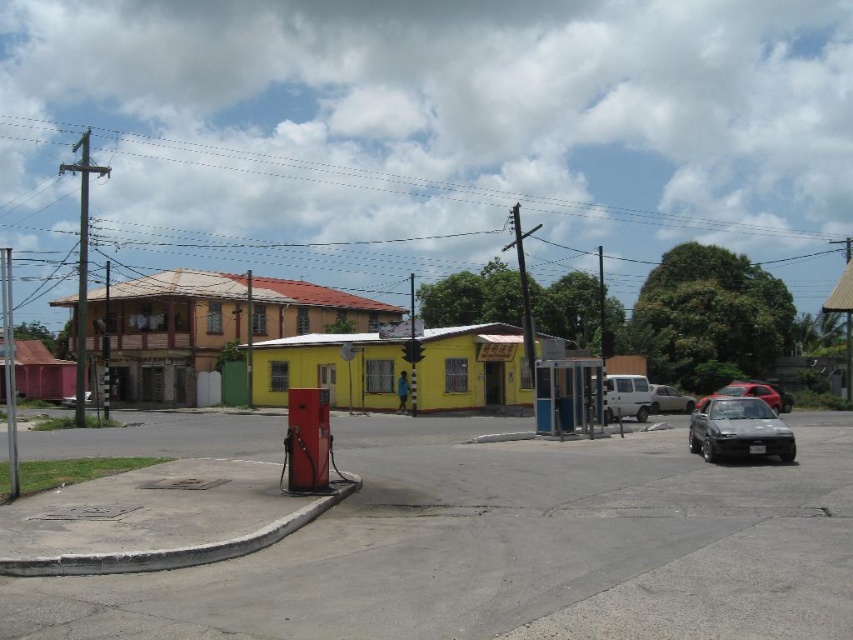
Question: Is metallic silver car at center above metallic silver car at lower left?

Choices:
 (A) no
 (B) yes

Answer: (A)

Question: Is metallic silver car at right below metallic silver car at center?

Choices:
 (A) no
 (B) yes

Answer: (A)

Question: Estimate the real-world distances between objects in this image. Which object is closer to the metallic silver car at center?

Choices:
 (A) metallic silver car at right
 (B) metallic silver car at lower left

Answer: (A)

Question: Estimate the real-world distances between objects in this image. Which object is farther from the metallic silver car at right?

Choices:
 (A) metallic silver car at lower left
 (B) shiny black car at right

Answer: (A)

Question: Among these objects, which one is farthest from the camera?

Choices:
 (A) metallic silver car at right
 (B) shiny black car at right
 (C) metallic silver car at center

Answer: (C)

Question: Where is metallic silver car at right located in relation to metallic silver car at center in the image?

Choices:
 (A) above
 (B) below

Answer: (A)